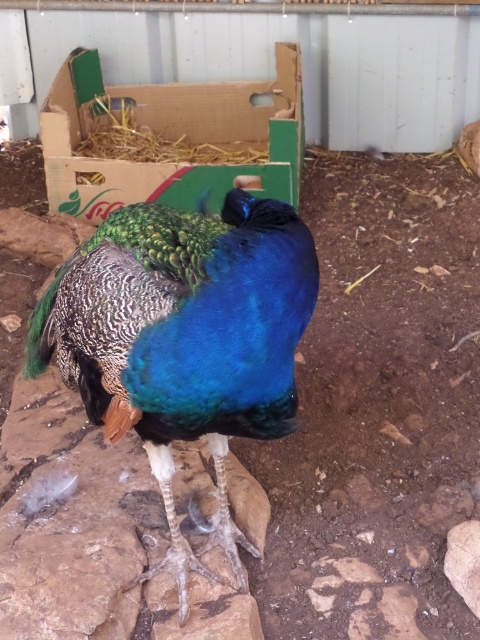
Which is more to the right, cardboard box at upper center or straw hay at upper center?

cardboard box at upper center is more to the right.

Does cardboard box at upper center appear on the right side of straw hay at upper center?

Correct, you'll find cardboard box at upper center to the right of straw hay at upper center.

Identify the location of cardboard box at upper center. The width and height of the screenshot is (480, 640). (169, 138).

Where is `cardboard box at upper center`? Image resolution: width=480 pixels, height=640 pixels. cardboard box at upper center is located at coordinates (169, 138).

Measure the distance between point (249, 333) and camera.

Point (249, 333) and camera are 3.89 feet apart.

Image resolution: width=480 pixels, height=640 pixels. What are the coordinates of `shiny blue peacock at center` in the screenshot? It's located at click(x=183, y=339).

The image size is (480, 640). Find the location of `shiny blue peacock at center`. shiny blue peacock at center is located at coordinates (183, 339).

Does point (223, 481) lie in front of point (159, 109)?

Yes, point (223, 481) is in front of point (159, 109).

Is shiny blue peacock at center below cardboard box at upper center?

Correct, shiny blue peacock at center is located below cardboard box at upper center.

Locate an element on the screen. The image size is (480, 640). shiny blue peacock at center is located at coordinates (183, 339).